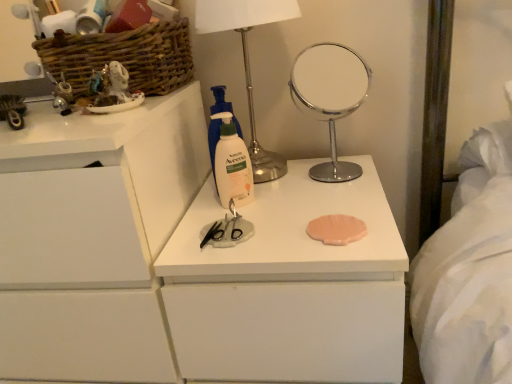
I want to click on vacant space to the right of white matte aveeno lotion at center, so click(314, 198).